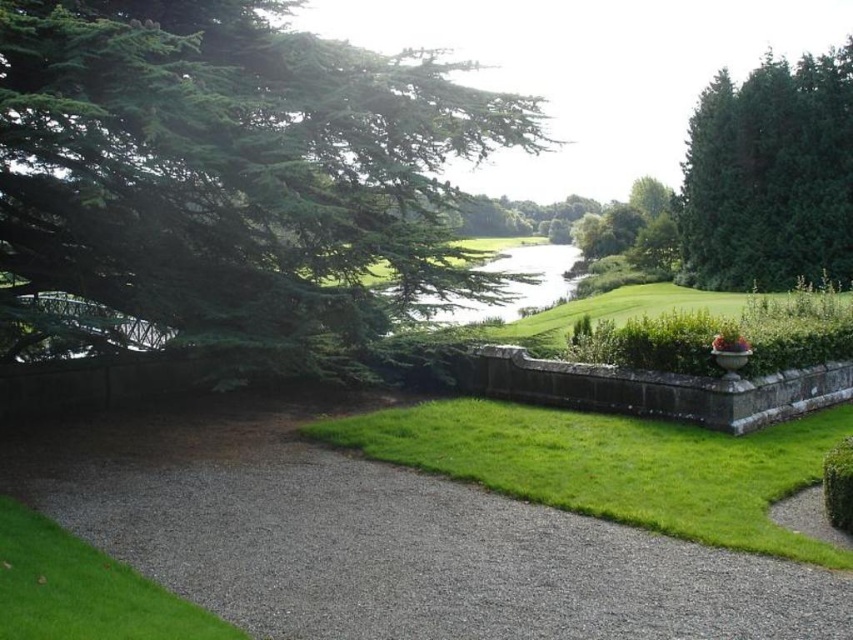
Question: Among these objects, which one is farthest from the camera?

Choices:
 (A) green grass at lower left
 (B) green needle-like tree at upper left
 (C) dark green textured tree at upper right

Answer: (C)

Question: Is green needle-like tree at upper left above dark green textured tree at upper right?

Choices:
 (A) no
 (B) yes

Answer: (A)

Question: Which of these objects is positioned farthest from the green leafy hedge at lower right?

Choices:
 (A) dark green textured tree at upper right
 (B) gray gravel path at center

Answer: (A)

Question: Which point appears closest to the camera in this image?

Choices:
 (A) (70, 51)
 (B) (193, 568)
 (C) (689, 440)
 (D) (840, 525)

Answer: (B)

Question: Is gray gravel path at center smaller than dark green textured tree at upper right?

Choices:
 (A) no
 (B) yes

Answer: (B)

Question: Is gray gravel path at center bigger than green grass at center?

Choices:
 (A) no
 (B) yes

Answer: (B)